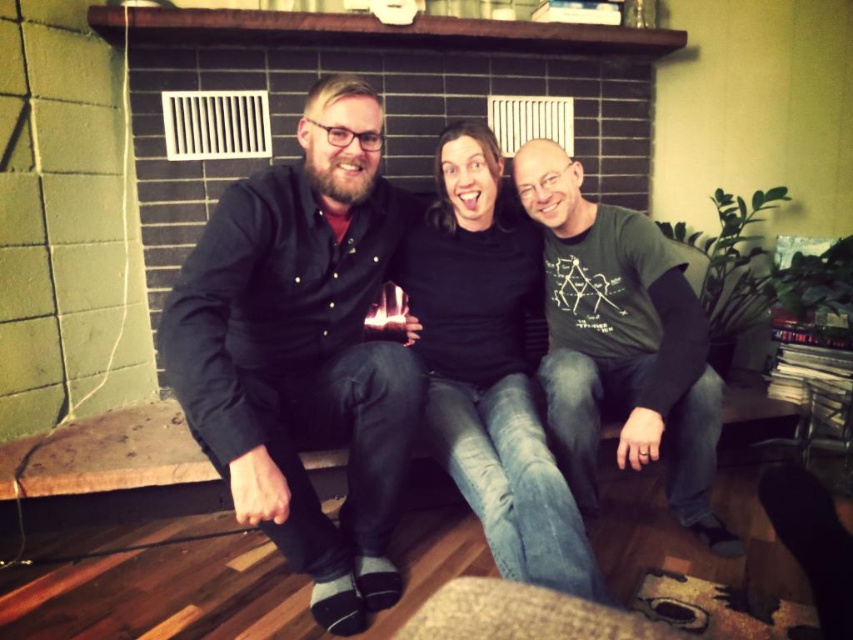
How much distance is there between black matte shirt at left and green cotton t-shirt at center?

black matte shirt at left is 23.77 inches from green cotton t-shirt at center.

Based on the photo, can you confirm if black matte shirt at left is positioned to the right of green cotton t-shirt at center?

In fact, black matte shirt at left is to the left of green cotton t-shirt at center.

Between point (238, 355) and point (612, 371), which one is positioned behind?

The point (612, 371) is behind.

I want to click on black matte shirt at left, so click(x=305, y=349).

Can you confirm if black matte shirt at left is wider than black matte shirt at center?

Correct, the width of black matte shirt at left exceeds that of black matte shirt at center.

Is black matte shirt at left behind black matte shirt at center?

No.

Between point (316, 128) and point (506, 385), which one is positioned behind?

Positioned behind is point (506, 385).

Locate an element on the screen. The width and height of the screenshot is (853, 640). black matte shirt at left is located at coordinates (305, 349).

Does black matte shirt at center appear on the left side of green cotton t-shirt at center?

Correct, you'll find black matte shirt at center to the left of green cotton t-shirt at center.

Between black matte shirt at center and green cotton t-shirt at center, which one is positioned higher?

green cotton t-shirt at center

Which is in front, point (517, 372) or point (595, 433)?

Point (595, 433) is in front.

At what (x,y) coordinates should I click in order to perform the action: click on black matte shirt at center. Please return your answer as a coordinate pair (x, y). This screenshot has height=640, width=853. Looking at the image, I should click on (489, 364).